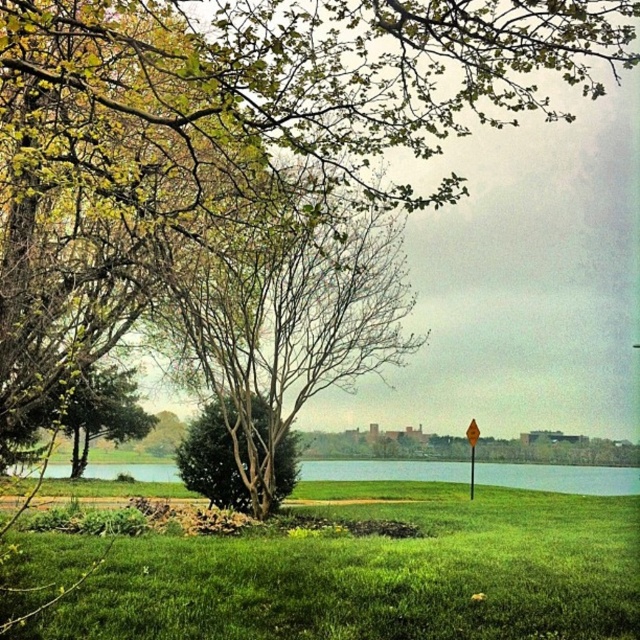
Is green leafy bush at center wider than yellow reflective plastic at center?

Indeed, green leafy bush at center has a greater width compared to yellow reflective plastic at center.

Between point (189, 458) and point (472, 422), which one is positioned behind?

The point (472, 422) is more distant.

Locate an element on the screen. This screenshot has width=640, height=640. green leafy bush at center is located at coordinates (211, 461).

Based on the photo, which is above, green leafy bush at center or yellow plastic street sign at upper center?

Positioned higher is yellow plastic street sign at upper center.

Between point (211, 477) and point (472, 429), which one is positioned in front?

Point (211, 477)

You are a GUI agent. You are given a task and a screenshot of the screen. Output one action in this format:
    pyautogui.click(x=<x>, y=<y>)
    Task: Click on the green leafy bush at center
    
    Given the screenshot: What is the action you would take?
    pyautogui.click(x=211, y=461)

Between point (216, 376) and point (467, 436), which one is positioned behind?

Point (467, 436)

Is green leafy tree at center bigger than yellow plastic street sign at upper center?

Yes, green leafy tree at center is bigger than yellow plastic street sign at upper center.

Is point (252, 205) closer to viewer compared to point (474, 452)?

Yes, it is in front of point (474, 452).

Locate an element on the screen. Image resolution: width=640 pixels, height=640 pixels. green leafy tree at center is located at coordinates (280, 307).